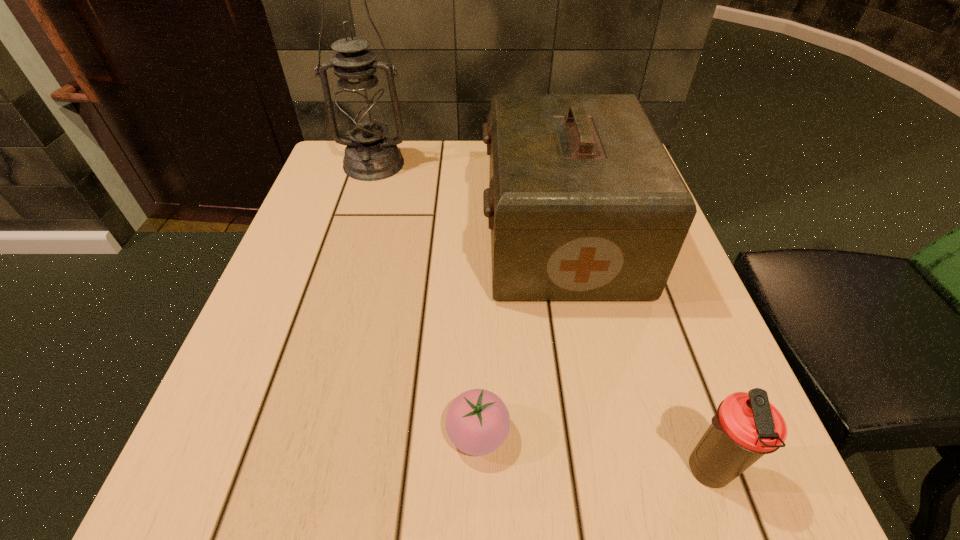
Locate an element on the screen. This screenshot has width=960, height=540. the tallest object is located at coordinates (363, 112).

This screenshot has width=960, height=540. What are the coordinates of `oil lamp` in the screenshot? It's located at (363, 112).

The height and width of the screenshot is (540, 960). Identify the location of the third nearest object. (584, 203).

Where is `the first-aid kit`? This screenshot has width=960, height=540. the first-aid kit is located at coordinates (584, 203).

You are a GUI agent. You are given a task and a screenshot of the screen. Output one action in this format:
    pyautogui.click(x=<x>, y=<y>)
    Task: Click on the thermos bottle
    
    Given the screenshot: What is the action you would take?
    pyautogui.click(x=747, y=426)

At what (x,y) coordinates should I click in order to perform the action: click on the shortest object. Please return your answer as a coordinate pair (x, y). This screenshot has height=540, width=960. Looking at the image, I should click on (x=477, y=422).

This screenshot has width=960, height=540. In order to click on vacant space positioned 0.230m on the right of the leftmost object in this screenshot , I will do `click(504, 164)`.

Locate an element on the screen. The height and width of the screenshot is (540, 960). vacant region located on the front of the second farthest object is located at coordinates (586, 370).

Where is `vacant space located 0.230m on the back of the thermos bottle`? This screenshot has height=540, width=960. vacant space located 0.230m on the back of the thermos bottle is located at coordinates (651, 310).

I want to click on blank space located on the right of the tomato, so click(x=731, y=434).